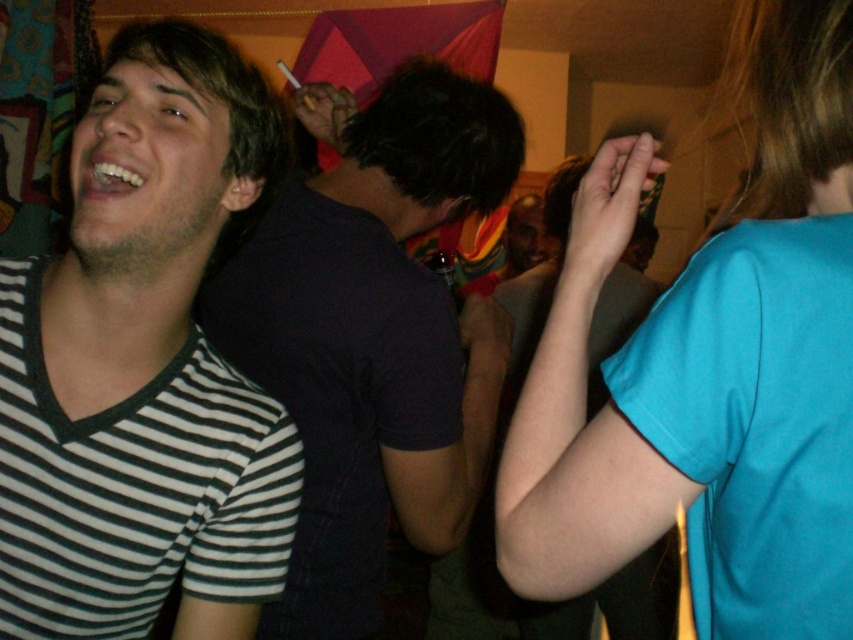
You are at a party and want to introduce yourself to the rainbow striped shirt at center. Which direction should you move to approach them from the matte black shirt at center?

The matte black shirt at center is to the right of the rainbow striped shirt at center, so to approach the rainbow striped shirt at center from the matte black shirt at center, you should move to the left.

From the picture: You are standing in the middle of the room and want to move towards the two points in the image. Which point, point (289, 525) or point (467, 618), is closer to you?

Point (289, 525) is closer to the viewer than point (467, 618), so you should move towards point (289, 525) first.